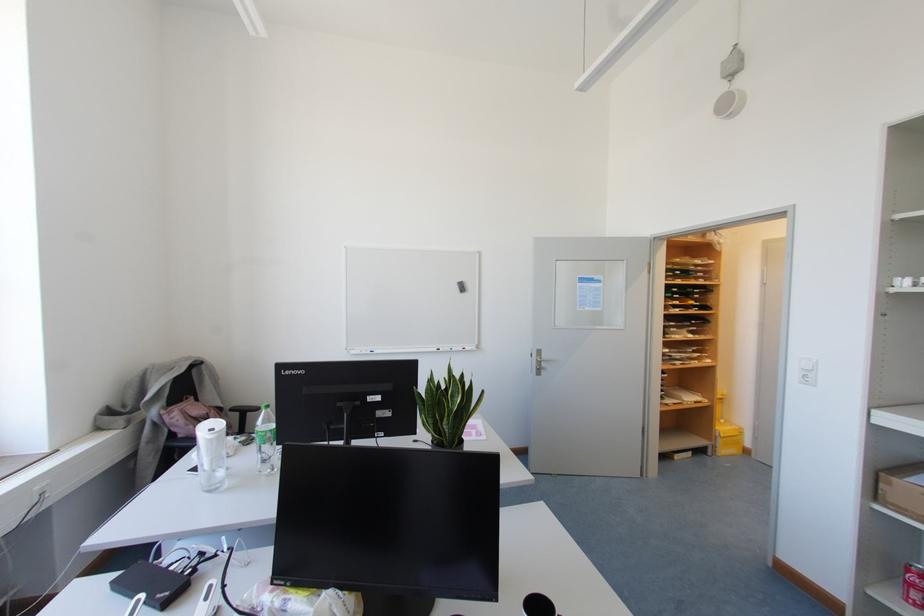
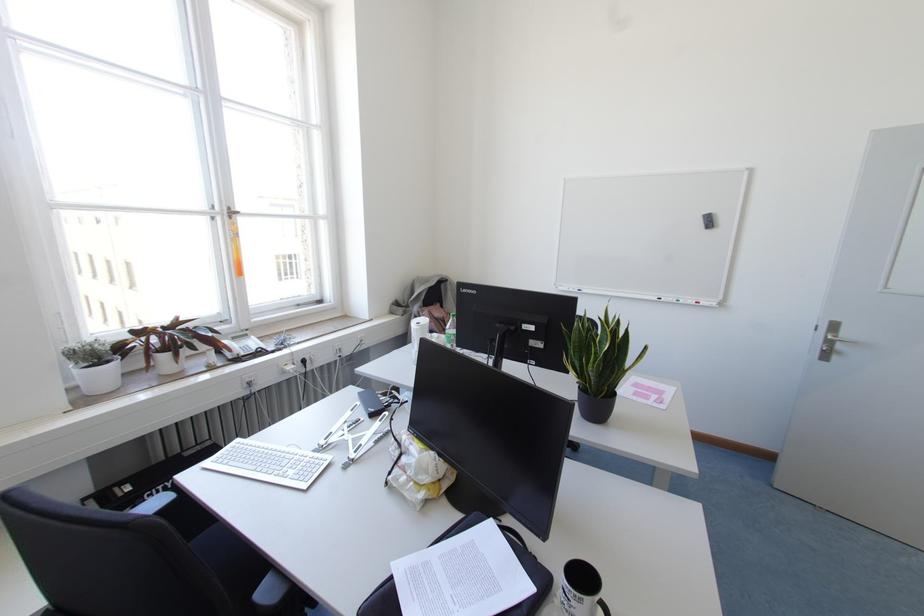
Find the pixel in the second image that matches (541,358) in the first image.

(834, 336)